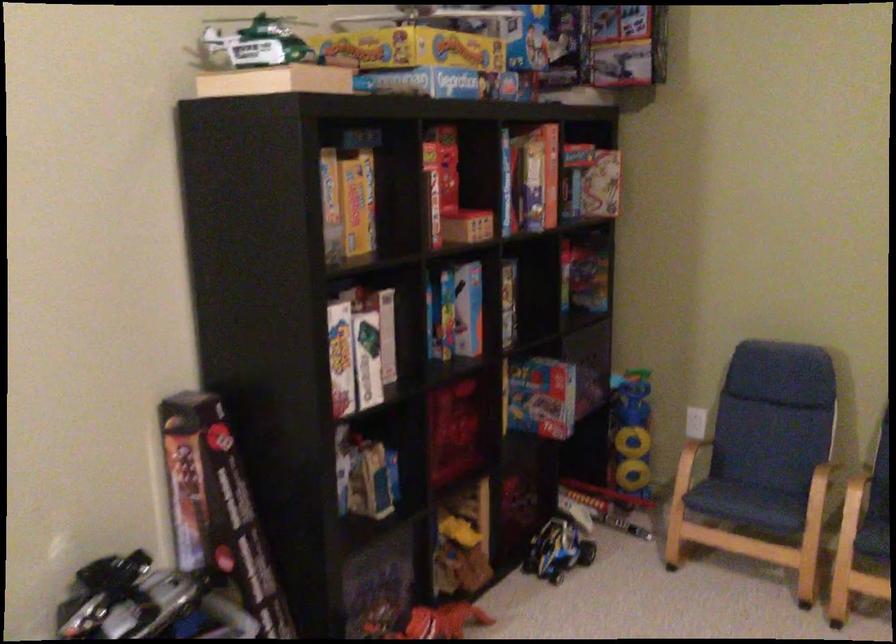
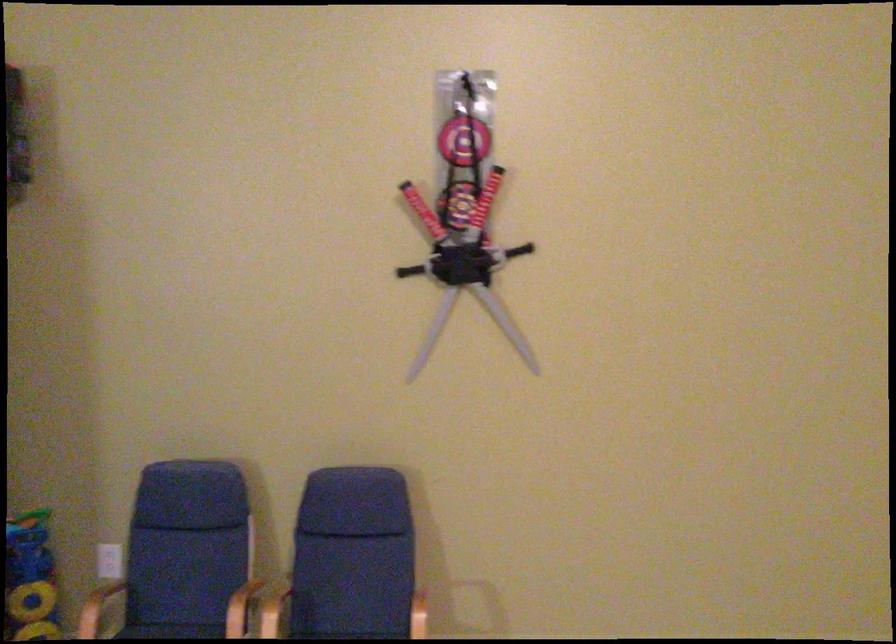
Question: The images are taken continuously from a first-person perspective. In which direction is your viewpoint rotating?

Choices:
 (A) Left
 (B) Right
 (C) Up
 (D) Down

Answer: (B)